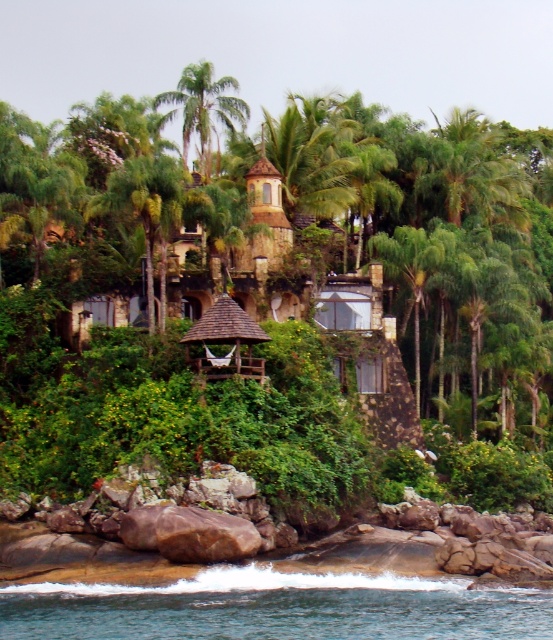
Question: Which point is farther to the camera?

Choices:
 (A) click(399, 397)
 (B) click(186, 131)
 (C) click(236, 612)
 (D) click(170, 195)

Answer: (B)

Question: Is clear blue water at lower center bigger than green leafy palm tree at upper center?

Choices:
 (A) no
 (B) yes

Answer: (A)

Question: Can you confirm if rustic wood hut at center is positioned to the left of green leafy palm tree at center?

Choices:
 (A) no
 (B) yes

Answer: (A)

Question: Which object is farther from the camera taking this photo?

Choices:
 (A) clear blue water at lower center
 (B) green leafy palm tree at upper center

Answer: (B)

Question: Does clear blue water at lower center appear under green leafy palm tree at upper center?

Choices:
 (A) yes
 (B) no

Answer: (A)

Question: Based on their relative distances, which object is nearer to the rustic wood hut at center?

Choices:
 (A) green leafy palm tree at upper center
 (B) green leafy palm tree at center
 (C) clear blue water at lower center

Answer: (B)